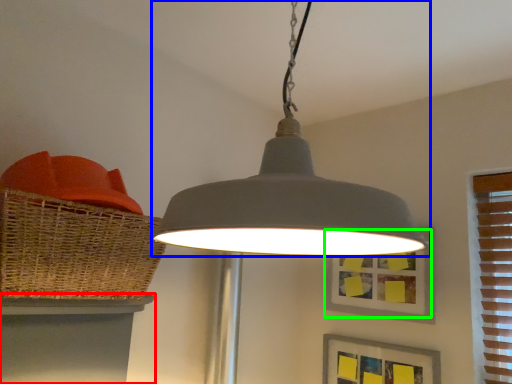
Question: Estimate the real-world distances between objects in this image. Which object is closer to table (highlighted by a red box), lamp (highlighted by a blue box) or picture frame (highlighted by a green box)?

Choices:
 (A) lamp
 (B) picture frame

Answer: (A)